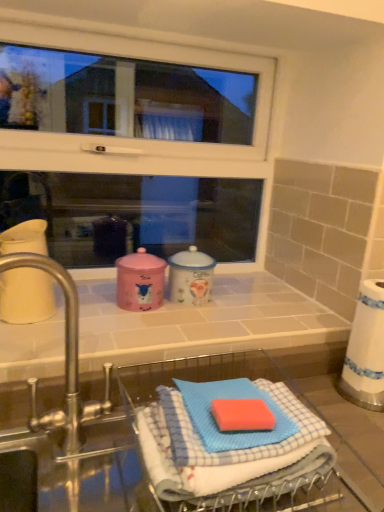
Find the location of a particular element. Image resolution: width=384 pixels, height=512 pixels. blank space situated above blue checkered cloth at lower center (from a real-world perspective) is located at coordinates (234, 405).